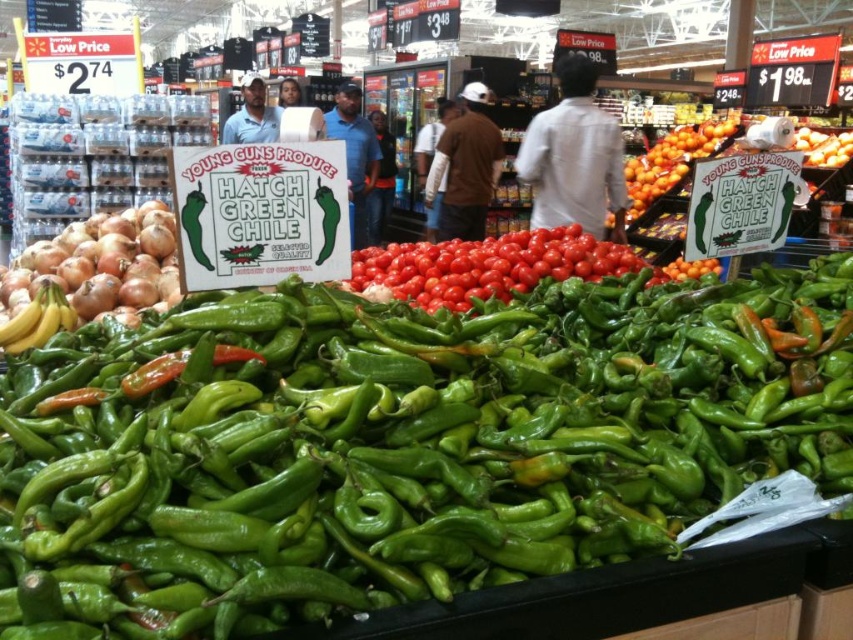
Question: Among these objects, which one is farthest from the camera?

Choices:
 (A) blue shirt at center
 (B) brown cotton shirt at center

Answer: (A)

Question: Estimate the real-world distances between objects in this image. Which object is closer to the brown matte onion at left?

Choices:
 (A) brown cotton shirt at center
 (B) dark blue jeans at center
 (C) blue shirt at center
 (D) brown leather jacket at upper center

Answer: (A)

Question: Can you confirm if white matte shirt at center is positioned above smooth skin face at center?

Choices:
 (A) no
 (B) yes

Answer: (A)

Question: Which object is the farthest from the blue shirt at center?

Choices:
 (A) white matte shirt at center
 (B) brown leather jacket at upper center

Answer: (A)

Question: Is white matte shirt at center thinner than matte blue shirt at center?

Choices:
 (A) no
 (B) yes

Answer: (B)

Question: Is dark blue jeans at center positioned before brown leather jacket at upper center?

Choices:
 (A) no
 (B) yes

Answer: (A)